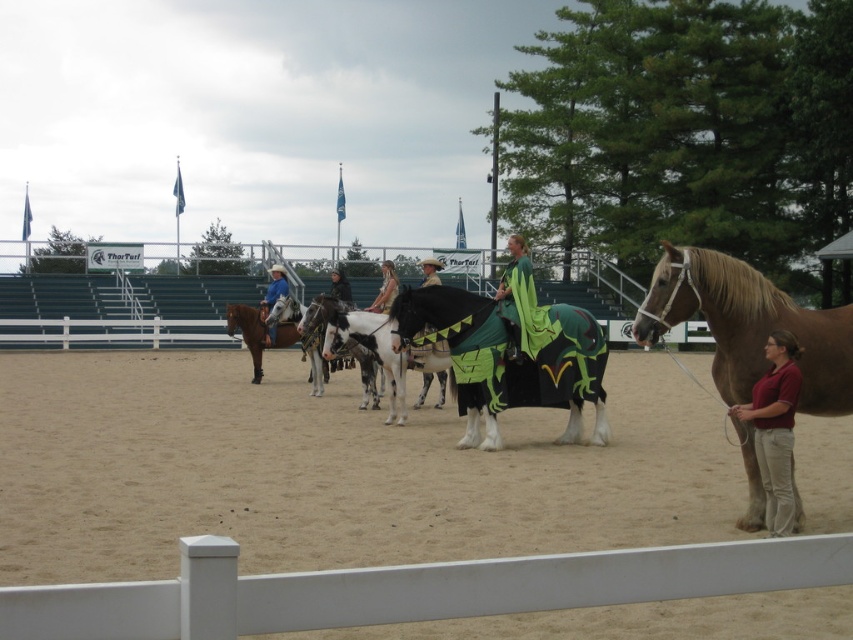
You are a photographer positioned at the edge of the sandy arena. You want to capture a photo of the green fabric cape at center and the sandy dirt field at center. Which object will appear larger in the photo?

The green fabric cape at center will appear larger in the photo because it is taller than the sandy dirt field at center.

Consider the image. You are a photographer trying to capture a wide shot of the equestrian event. Since you want to include both the sandy dirt field at center and the green fabric cape at center in the frame, which object should you focus on to ensure both are visible?

The sandy dirt field at center is larger in size than the green fabric cape at center, so focusing on the sandy dirt field at center will help ensure both objects are visible in the frame.